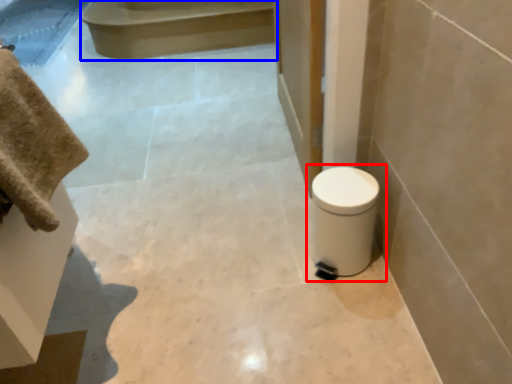
Question: Which of the following is the farthest to the observer, toilet (highlighted by a red box) or stair (highlighted by a blue box)?

Choices:
 (A) toilet
 (B) stair

Answer: (B)